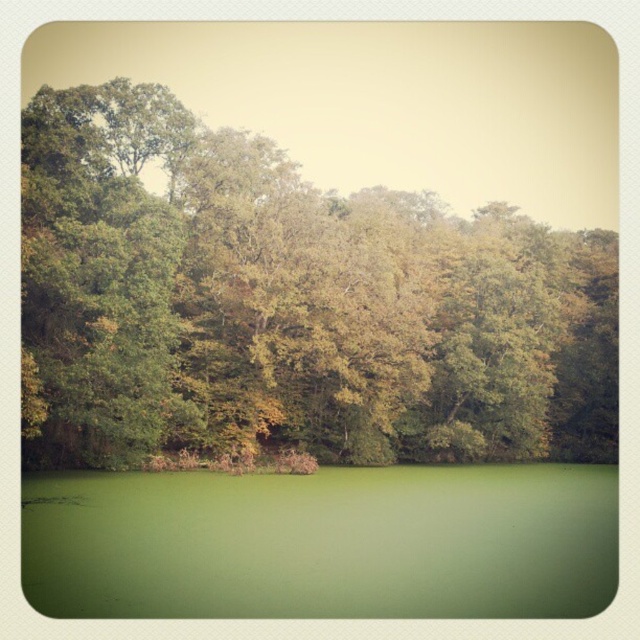
You are standing at the edge of the water and looking towards the forest. Which object, the green leafy trees at upper center or the green matte water at bottom, is closer to your eyes?

The green leafy trees at upper center are closer to your eyes because they are positioned above the green matte water at bottom, meaning they are in a higher plane relative to your viewpoint.

From the picture: You are standing in the middle of the forest and looking towards the dense canopy overhead. Where exactly are the green leafy trees at upper center located in terms of coordinates?

The green leafy trees at upper center are located at coordinates point (289, 305).

Based on the scene described, which object occupies more horizontal space in the image between the green leafy trees at upper center and the green matte water at bottom?

The green leafy trees at upper center occupy more horizontal space than the green matte water at bottom as stated in the description.